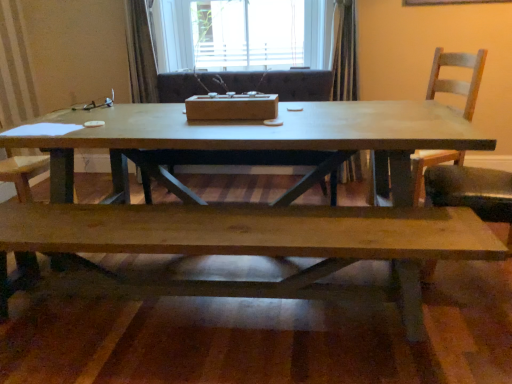
Question: Could you tell me if matte wood coffee table at center is turned towards wooden armchair at center?

Choices:
 (A) yes
 (B) no

Answer: (A)

Question: Is matte wood coffee table at center far from wooden armchair at center?

Choices:
 (A) no
 (B) yes

Answer: (A)

Question: Is matte wood coffee table at center looking in the opposite direction of wooden armchair at center?

Choices:
 (A) yes
 (B) no

Answer: (A)

Question: Does matte wood coffee table at center have a smaller size compared to wooden armchair at center?

Choices:
 (A) no
 (B) yes

Answer: (A)

Question: Is matte wood coffee table at center to the left of wooden armchair at center from the viewer's perspective?

Choices:
 (A) yes
 (B) no

Answer: (A)

Question: Based on their positions, is natural wood bench at lower center located to the left or right of wooden armchair at center?

Choices:
 (A) right
 (B) left

Answer: (B)

Question: Looking at the image, does natural wood bench at lower center seem bigger or smaller compared to wooden armchair at center?

Choices:
 (A) small
 (B) big

Answer: (A)

Question: Considering the positions of natural wood bench at lower center and wooden armchair at center in the image, is natural wood bench at lower center wider or thinner than wooden armchair at center?

Choices:
 (A) thin
 (B) wide

Answer: (A)

Question: In the image, is natural wood bench at lower center positioned in front of or behind wooden armchair at center?

Choices:
 (A) front
 (B) behind

Answer: (A)

Question: Does point (398, 125) appear closer or farther from the camera than point (248, 220)?

Choices:
 (A) farther
 (B) closer

Answer: (A)

Question: Looking at their shapes, would you say matte wood coffee table at center is wider or thinner than natural wood bench at lower center?

Choices:
 (A) wide
 (B) thin

Answer: (A)

Question: Based on their sizes in the image, would you say matte wood coffee table at center is bigger or smaller than natural wood bench at lower center?

Choices:
 (A) big
 (B) small

Answer: (A)

Question: Is matte wood coffee table at center to the left or to the right of natural wood bench at lower center in the image?

Choices:
 (A) left
 (B) right

Answer: (B)

Question: From a real-world perspective, is wooden chair at right physically located above or below white wood window at upper center?

Choices:
 (A) below
 (B) above

Answer: (A)

Question: Considering the positions of wooden chair at right and white wood window at upper center in the image, is wooden chair at right taller or shorter than white wood window at upper center?

Choices:
 (A) tall
 (B) short

Answer: (A)